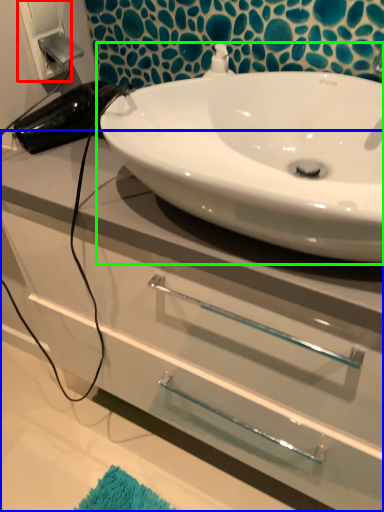
Question: Which is nearer to the electric outlet (highlighted by a red box)? bathroom cabinet (highlighted by a blue box) or sink (highlighted by a green box).

Choices:
 (A) bathroom cabinet
 (B) sink

Answer: (B)